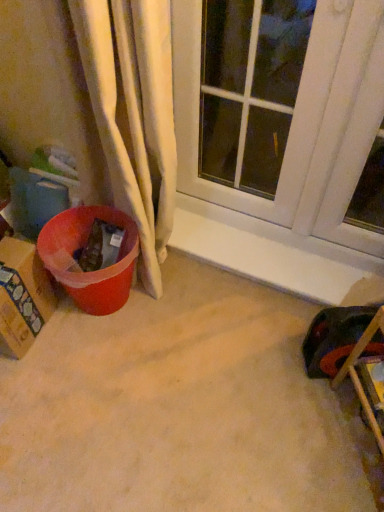
Question: Is cardboard box at left at the back of wooden chair at lower right?

Choices:
 (A) no
 (B) yes

Answer: (A)

Question: Considering the relative sizes of wooden chair at lower right and cardboard box at left in the image provided, is wooden chair at lower right bigger than cardboard box at left?

Choices:
 (A) no
 (B) yes

Answer: (B)

Question: Is wooden chair at lower right positioned before cardboard box at left?

Choices:
 (A) no
 (B) yes

Answer: (B)

Question: Is wooden chair at lower right further to the viewer compared to cardboard box at left?

Choices:
 (A) no
 (B) yes

Answer: (A)

Question: Is wooden chair at lower right to the right of cardboard box at left from the viewer's perspective?

Choices:
 (A) no
 (B) yes

Answer: (B)

Question: From the image's perspective, would you say wooden chair at lower right is shown under cardboard box at left?

Choices:
 (A) no
 (B) yes

Answer: (B)

Question: Considering the relative sizes of wooden chair at lower right and white glass window at upper center in the image provided, is wooden chair at lower right taller than white glass window at upper center?

Choices:
 (A) no
 (B) yes

Answer: (A)

Question: Is wooden chair at lower right next to white glass window at upper center and touching it?

Choices:
 (A) no
 (B) yes

Answer: (A)

Question: Does wooden chair at lower right appear on the left side of white glass window at upper center?

Choices:
 (A) no
 (B) yes

Answer: (A)

Question: Is wooden chair at lower right shorter than white glass window at upper center?

Choices:
 (A) no
 (B) yes

Answer: (B)

Question: Could white glass window at upper center be considered to be inside wooden chair at lower right?

Choices:
 (A) yes
 (B) no

Answer: (B)

Question: From a real-world perspective, is wooden chair at lower right over white glass window at upper center?

Choices:
 (A) no
 (B) yes

Answer: (A)

Question: Does cardboard box at left lie behind wooden chair at lower right?

Choices:
 (A) yes
 (B) no

Answer: (A)